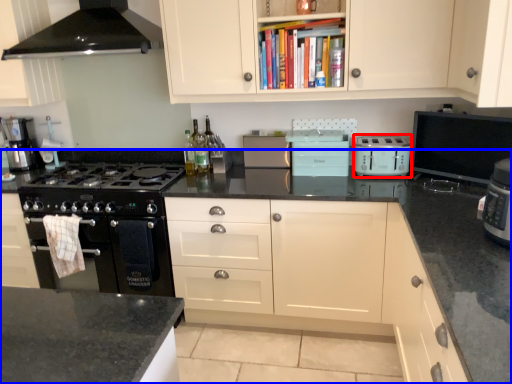
Question: Which object is further to the camera taking this photo, kitchen appliance (highlighted by a red box) or countertop (highlighted by a blue box)?

Choices:
 (A) kitchen appliance
 (B) countertop

Answer: (A)